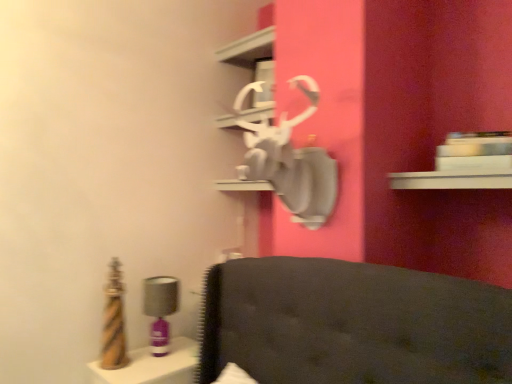
Question: Is matte purple table lamp at left oriented away from white glossy shelf at upper center?

Choices:
 (A) yes
 (B) no

Answer: (B)

Question: Is the surface of matte purple table lamp at left in direct contact with white glossy shelf at upper center?

Choices:
 (A) no
 (B) yes

Answer: (A)

Question: Is matte purple table lamp at left surrounding white glossy shelf at upper center?

Choices:
 (A) no
 (B) yes

Answer: (A)

Question: Can you confirm if matte purple table lamp at left is positioned to the right of white glossy shelf at upper center?

Choices:
 (A) yes
 (B) no

Answer: (B)

Question: Considering the relative positions of matte purple table lamp at left and white glossy shelf at upper center in the image provided, is matte purple table lamp at left behind white glossy shelf at upper center?

Choices:
 (A) no
 (B) yes

Answer: (A)

Question: From a real-world perspective, is matte purple table lamp at left over white glossy shelf at upper center?

Choices:
 (A) yes
 (B) no

Answer: (B)

Question: Is white glossy shelf at upper center positioned behind matte purple table lamp at left?

Choices:
 (A) no
 (B) yes

Answer: (B)

Question: Is white glossy shelf at upper center not inside matte purple table lamp at left?

Choices:
 (A) yes
 (B) no

Answer: (A)

Question: Considering the relative sizes of white glossy shelf at upper center and matte purple table lamp at left in the image provided, is white glossy shelf at upper center taller than matte purple table lamp at left?

Choices:
 (A) yes
 (B) no

Answer: (B)

Question: Is white glossy shelf at upper center at the left side of matte purple table lamp at left?

Choices:
 (A) yes
 (B) no

Answer: (B)

Question: From the image's perspective, is white glossy shelf at upper center located above matte purple table lamp at left?

Choices:
 (A) yes
 (B) no

Answer: (A)

Question: Considering the relative sizes of white glossy shelf at upper center and matte purple table lamp at left in the image provided, is white glossy shelf at upper center wider than matte purple table lamp at left?

Choices:
 (A) no
 (B) yes

Answer: (B)

Question: Does matte purple table lamp at left have a lesser height compared to metallic gold vanity at lower left?

Choices:
 (A) yes
 (B) no

Answer: (B)